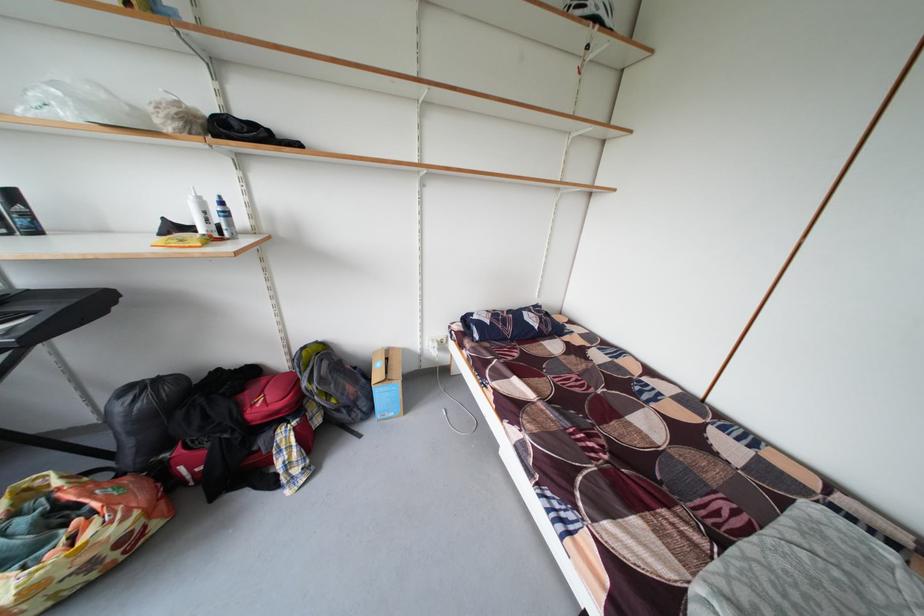
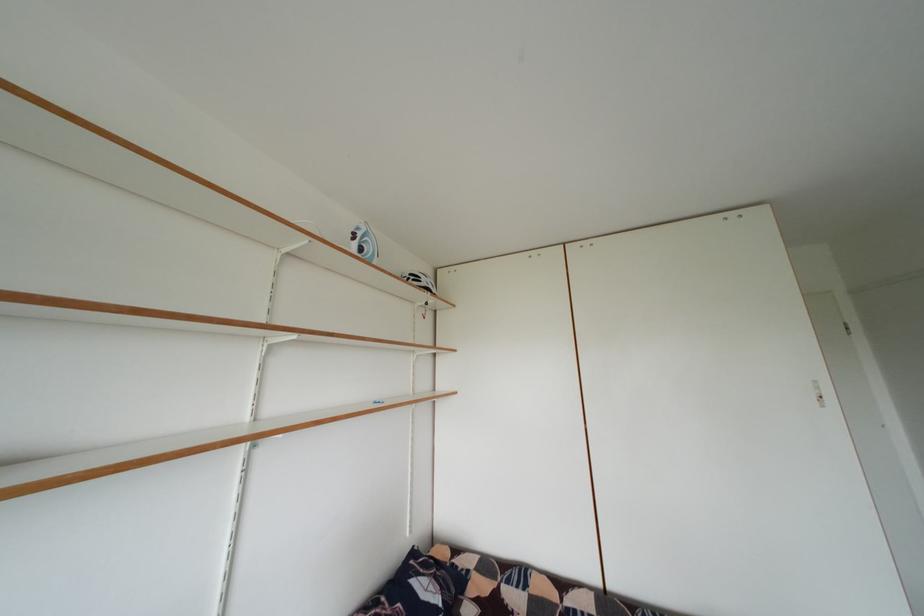
The images are taken continuously from a first-person perspective. In which direction is your viewpoint rotating?

The camera rotated toward right-up.